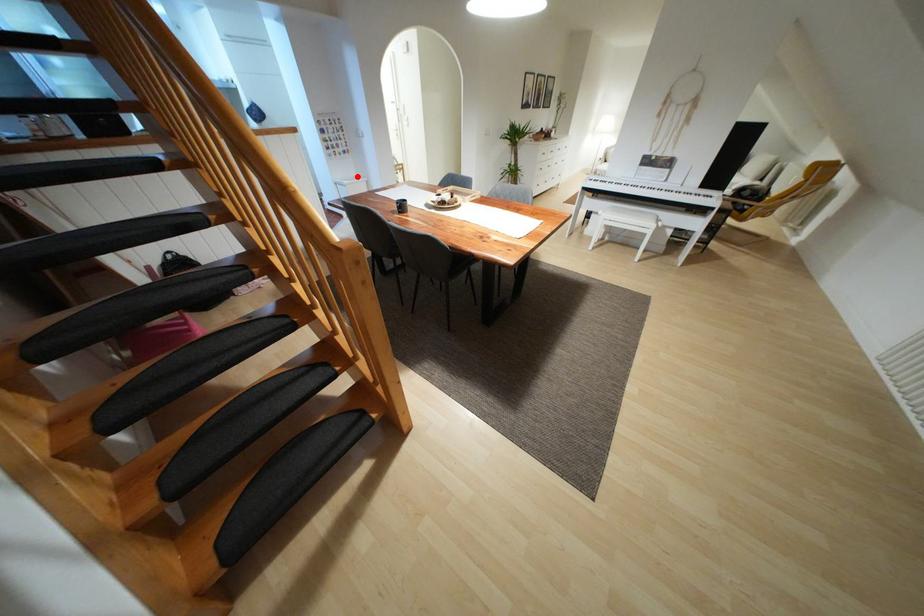
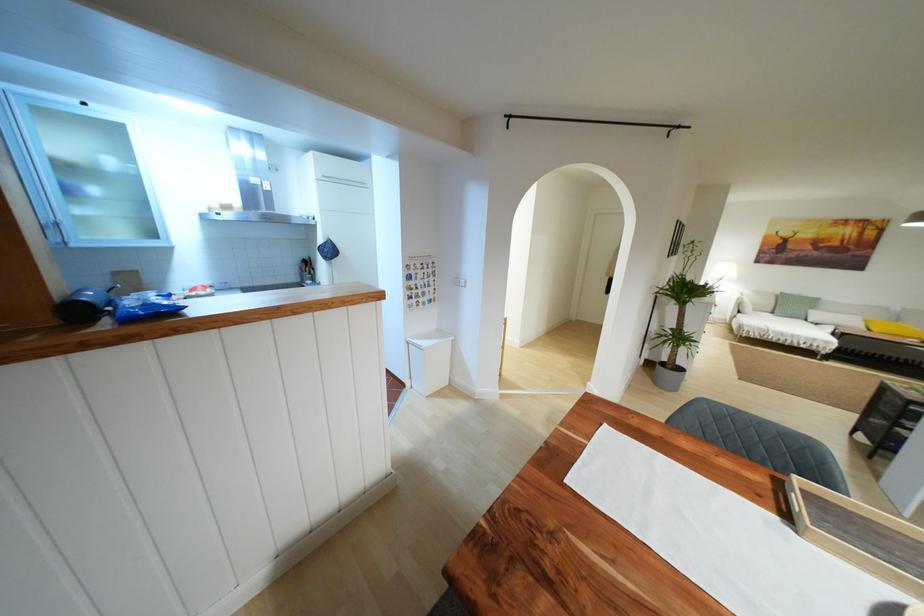
Where in the second image is the point corresponding to the highlighted location from the first image?

(439, 331)